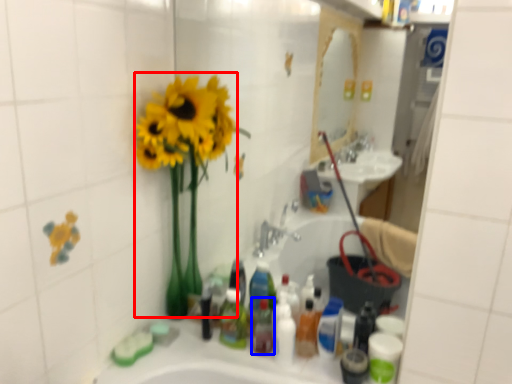
Question: Which of the following is the farthest to the observer, floral arrangement (highlighted by a red box) or mouthwash (highlighted by a blue box)?

Choices:
 (A) floral arrangement
 (B) mouthwash

Answer: (B)